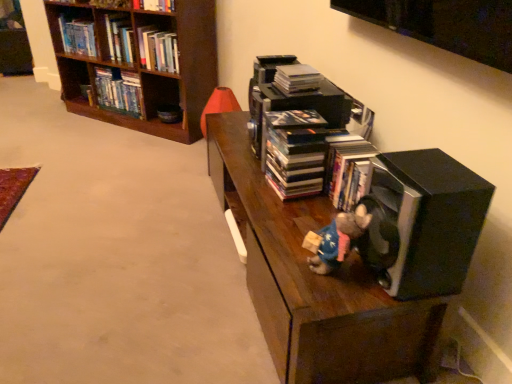
Locate an element on the screen. Image resolution: width=512 pixels, height=384 pixels. vacant area situated to the left side of black matte book at center, which appears as the first book when viewed from the right is located at coordinates (257, 185).